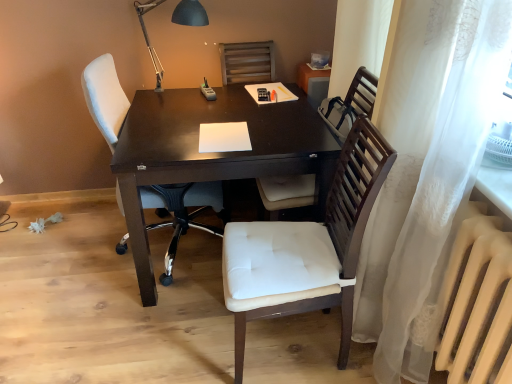
Find the location of a particular element. The image size is (512, 384). vacant space that is in between dark wood desk at center and white fabric chair at center, which is the second chair in left-to-right order is located at coordinates (197, 333).